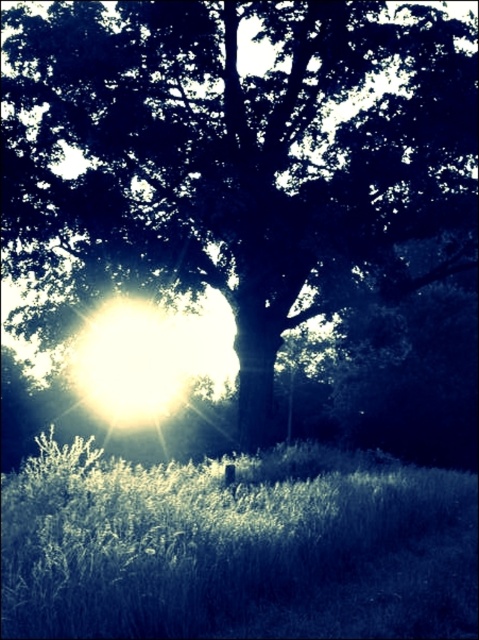
Question: Considering the relative positions of green leafy tree at center and green grass at lower center in the image provided, where is green leafy tree at center located with respect to green grass at lower center?

Choices:
 (A) above
 (B) below

Answer: (A)

Question: Which object is closer to the camera taking this photo?

Choices:
 (A) green grass at lower center
 (B) green leafy tree at center

Answer: (A)

Question: Which point is closer to the camera?

Choices:
 (A) green grass at lower center
 (B) green leafy tree at center

Answer: (A)

Question: Is green leafy tree at center bigger than green grass at lower center?

Choices:
 (A) no
 (B) yes

Answer: (B)

Question: Which object appears closest to the camera in this image?

Choices:
 (A) green leafy tree at center
 (B) green grass at lower center

Answer: (B)

Question: Is green leafy tree at center above green grass at lower center?

Choices:
 (A) no
 (B) yes

Answer: (B)